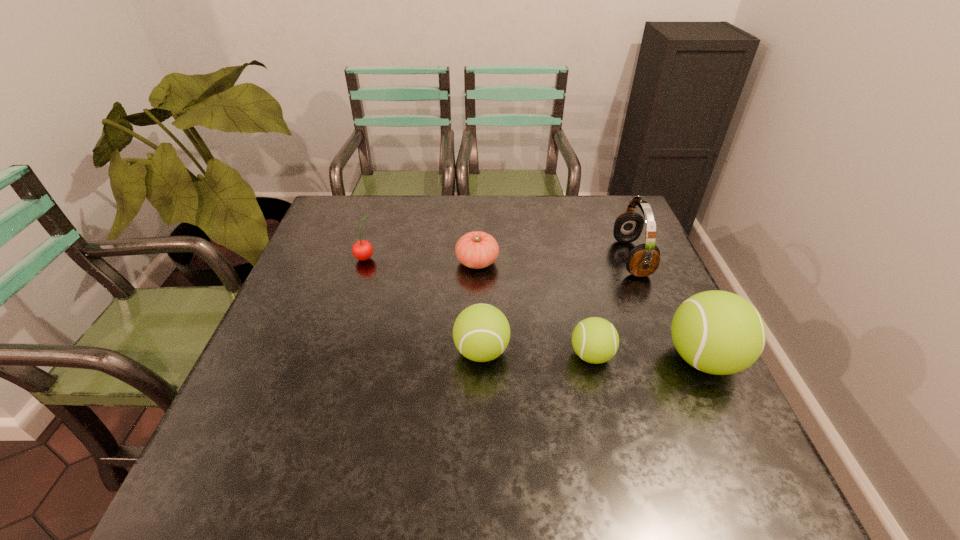
Identify the location of vacant space positioned 0.270m on the ear cups of the headset. This screenshot has width=960, height=540. (521, 258).

Find the location of a particular element. vacant region located 0.060m on the ear cups of the headset is located at coordinates (595, 258).

Find the location of a particular element. free space located 0.180m on the ear cups of the headset is located at coordinates (553, 258).

Identify the location of blank area located on the left of the tomato. (317, 262).

Find the location of a particular element. The image size is (960, 540). vacant area located 0.080m on the left of the cherry is located at coordinates (326, 258).

The height and width of the screenshot is (540, 960). I want to click on object that is at the far edge, so click(643, 260).

Find the location of a particular element. object located at the left edge is located at coordinates (362, 250).

Locate an element on the screen. The image size is (960, 540). tennis ball present at the right edge is located at coordinates (717, 332).

Where is `headset located at the right edge`? The image size is (960, 540). headset located at the right edge is located at coordinates (643, 260).

At what (x,y) coordinates should I click in order to perform the action: click on object situated at the far right corner. Please return your answer as a coordinate pair (x, y). Image resolution: width=960 pixels, height=540 pixels. Looking at the image, I should click on (643, 260).